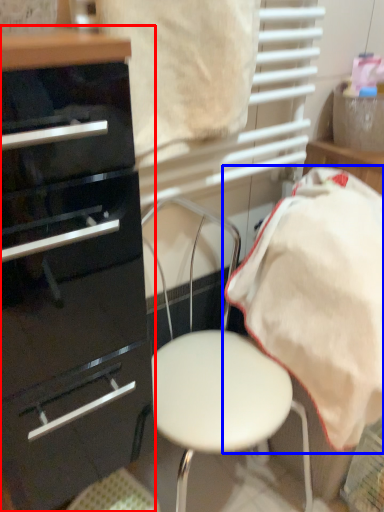
Question: Which object is further to the camera taking this photo, chest of drawers (highlighted by a red box) or bedding (highlighted by a blue box)?

Choices:
 (A) chest of drawers
 (B) bedding

Answer: (B)